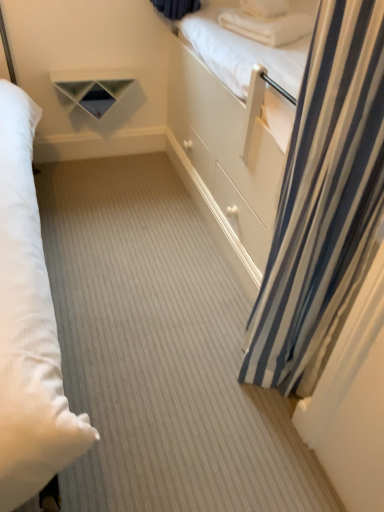
Question: Is blue striped curtain at right taller than white matte shelf at upper center?

Choices:
 (A) yes
 (B) no

Answer: (A)

Question: Is white matte shelf at upper center located within blue striped curtain at right?

Choices:
 (A) yes
 (B) no

Answer: (B)

Question: Is blue striped curtain at right bigger than white matte shelf at upper center?

Choices:
 (A) no
 (B) yes

Answer: (B)

Question: From the image's perspective, does blue striped curtain at right appear lower than white matte shelf at upper center?

Choices:
 (A) yes
 (B) no

Answer: (A)

Question: From the image's perspective, is blue striped curtain at right on white matte shelf at upper center?

Choices:
 (A) no
 (B) yes

Answer: (A)

Question: Is blue striped curtain at right situated inside white matte shelf at upper center or outside?

Choices:
 (A) inside
 (B) outside

Answer: (B)

Question: From the image's perspective, is blue striped curtain at right above or below white matte shelf at upper center?

Choices:
 (A) below
 (B) above

Answer: (A)

Question: In the image, is blue striped curtain at right on the left side or the right side of white matte shelf at upper center?

Choices:
 (A) left
 (B) right

Answer: (B)

Question: In terms of size, does blue striped curtain at right appear bigger or smaller than white matte shelf at upper center?

Choices:
 (A) big
 (B) small

Answer: (A)

Question: In terms of width, does white soft pillow at upper right, which appears as the second pillow when ordered from the bottom, look wider or thinner when compared to blue striped curtain at right?

Choices:
 (A) thin
 (B) wide

Answer: (A)

Question: Do you think white soft pillow at upper right, which appears as the second pillow when ordered from the bottom, is within blue striped curtain at right, or outside of it?

Choices:
 (A) outside
 (B) inside

Answer: (A)

Question: From a real-world perspective, is white soft pillow at upper right, which appears as the second pillow when ordered from the bottom, physically located above or below blue striped curtain at right?

Choices:
 (A) above
 (B) below

Answer: (A)

Question: Based on their positions, is white soft pillow at upper right, acting as the first pillow starting from the top, located to the left or right of blue striped curtain at right?

Choices:
 (A) left
 (B) right

Answer: (B)

Question: Is blue striped curtain at right situated inside white soft pillow at upper right, acting as the first pillow starting from the top, or outside?

Choices:
 (A) outside
 (B) inside

Answer: (A)

Question: Looking at the image, does blue striped curtain at right seem bigger or smaller compared to white soft pillow at upper right, acting as the first pillow starting from the top?

Choices:
 (A) big
 (B) small

Answer: (A)